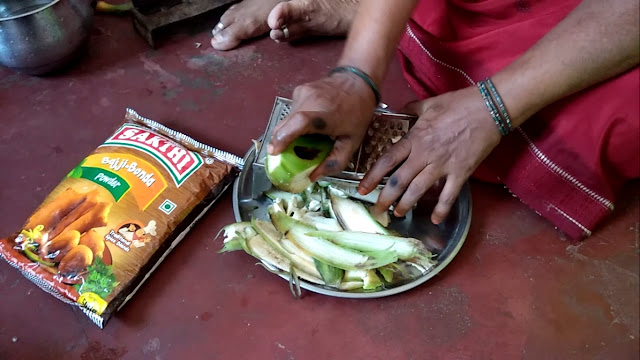
Identify the location of pot. (31, 31).